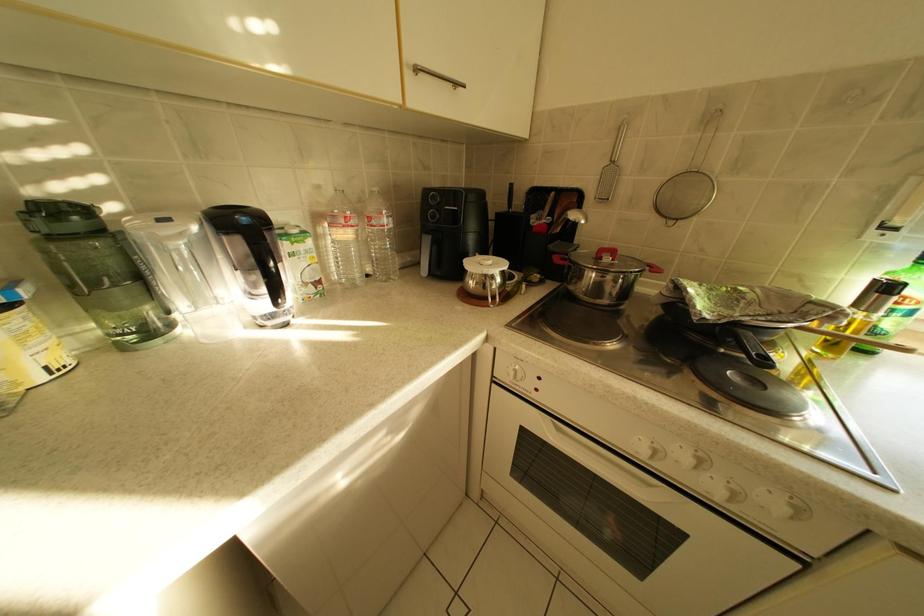
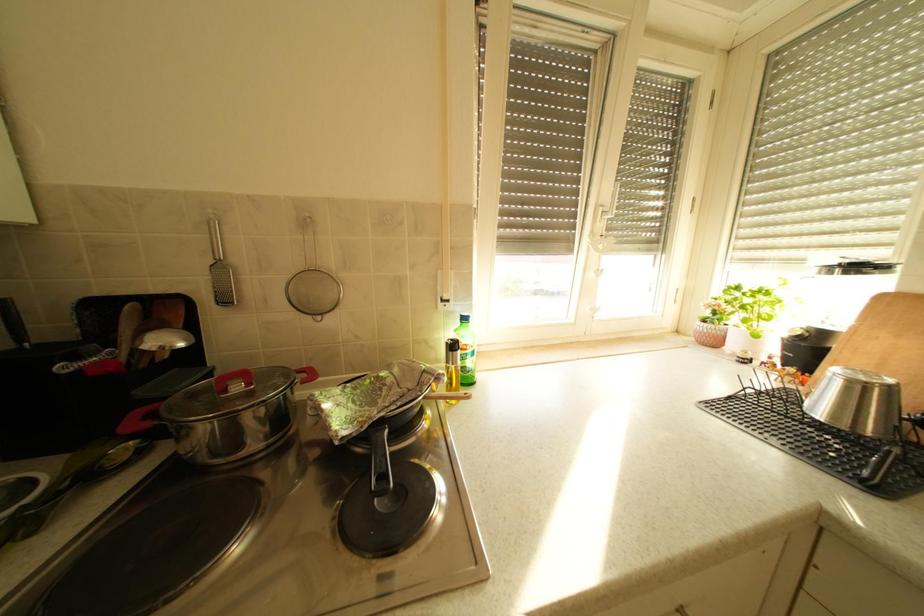
Question: The camera is either moving clockwise (left) or counter-clockwise (right) around the object. The first image is from the beginning of the video and the second image is from the end. Is the camera moving left or right when shooting the video?

Choices:
 (A) Left
 (B) Right

Answer: (A)